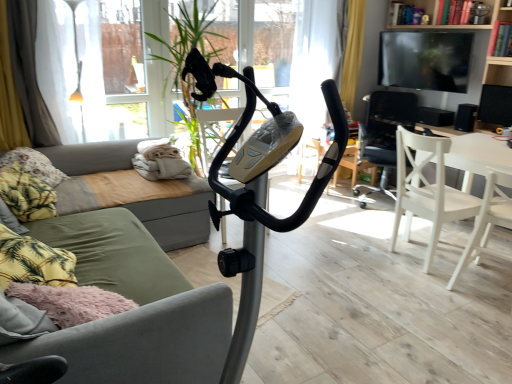
Locate an element on the screen. This screenshot has height=384, width=512. vacant space behind white wood chair at lower right, positioned as the 2th chair in back-to-front order is located at coordinates (375, 223).